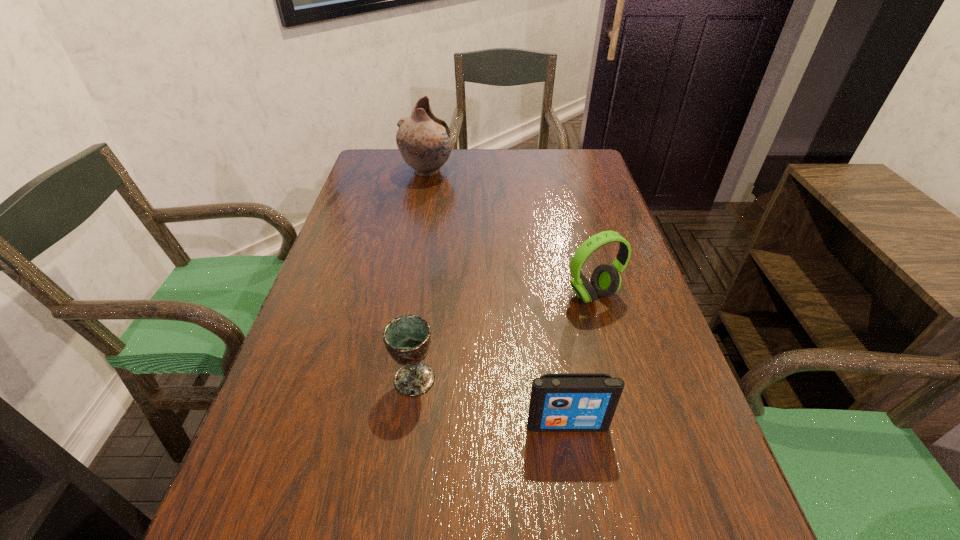
Locate which object ranks third in proximity to the chalice. Please provide its 2D coordinates. Your answer should be formatted as a tuple, i.e. [(x, y)], where the tuple contains the x and y coordinates of a point satisfying the conditions above.

[(424, 140)]

Where is `object identified as the closest to the pottery`? object identified as the closest to the pottery is located at coordinates pos(605,280).

You are a GUI agent. You are given a task and a screenshot of the screen. Output one action in this format:
    pyautogui.click(x=<x>, y=<y>)
    Task: Click on the free space that satisfies the following two spatial constraints: 1. from the spout of the third farthest object; 2. on the right side of the tallest object
    
    Given the screenshot: What is the action you would take?
    pyautogui.click(x=390, y=379)

This screenshot has width=960, height=540. I want to click on free region that satisfies the following two spatial constraints: 1. from the spout of the pottery; 2. on the left side of the second tallest object, so click(405, 295).

Identify the location of free spot that satisfies the following two spatial constraints: 1. on the back side of the second nearest object; 2. from the spout of the pottery. This screenshot has width=960, height=540. (442, 171).

The height and width of the screenshot is (540, 960). Identify the location of blank space that satisfies the following two spatial constraints: 1. from the spout of the farthest object; 2. on the right side of the chalice. (390, 379).

Where is `vacant area that satisfies the following two spatial constraints: 1. from the spout of the tallest object; 2. on the right side of the chalice`? The image size is (960, 540). vacant area that satisfies the following two spatial constraints: 1. from the spout of the tallest object; 2. on the right side of the chalice is located at coordinates (390, 379).

Where is `vacant point that satisfies the following two spatial constraints: 1. from the spout of the headset; 2. on the left side of the pottery`? This screenshot has width=960, height=540. vacant point that satisfies the following two spatial constraints: 1. from the spout of the headset; 2. on the left side of the pottery is located at coordinates (405, 295).

You are a GUI agent. You are given a task and a screenshot of the screen. Output one action in this format:
    pyautogui.click(x=<x>, y=<y>)
    Task: Click on the vacant space that satisfies the following two spatial constraints: 1. from the spout of the chalice; 2. on the left side of the tallest object
    The image size is (960, 540).
    Given the screenshot: What is the action you would take?
    pyautogui.click(x=390, y=379)